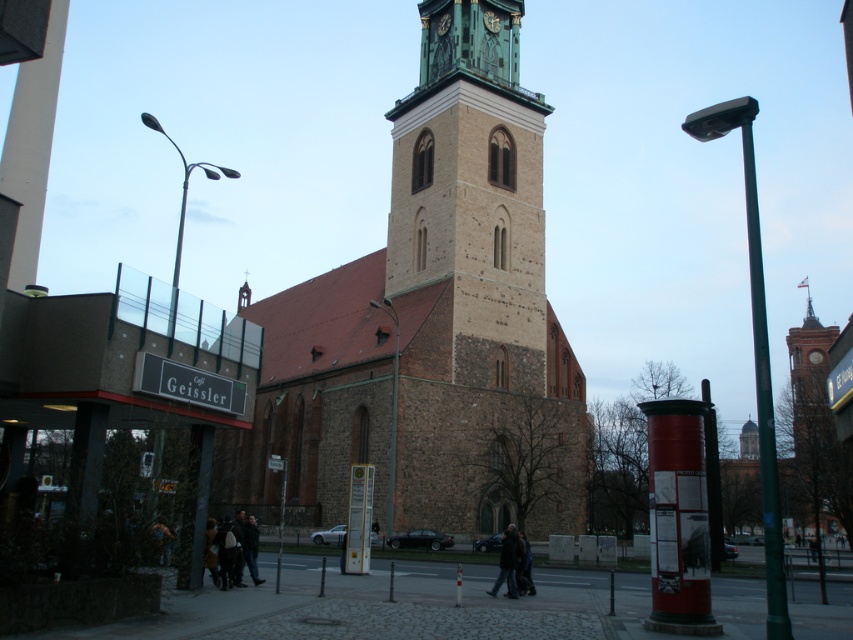
Question: Does brown stone church at center lie in front of brown stone tower at center?

Choices:
 (A) no
 (B) yes

Answer: (B)

Question: Is brown stone church at center in front of brown stone tower at center?

Choices:
 (A) yes
 (B) no

Answer: (A)

Question: Is the position of brown stone church at center more distant than that of brown stone tower at center?

Choices:
 (A) yes
 (B) no

Answer: (B)